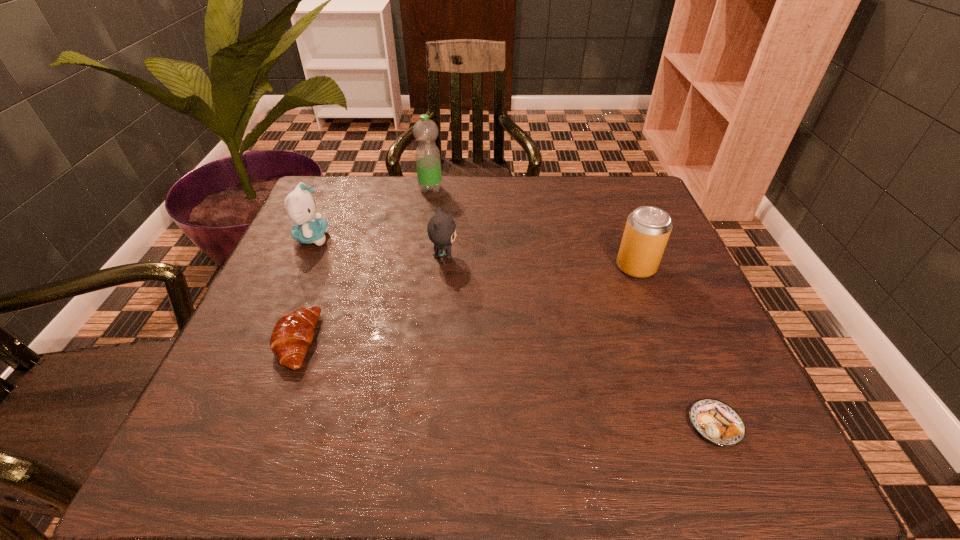
Locate an element on the screen. crescent roll that is at the left edge is located at coordinates (293, 333).

I want to click on pop (soda) that is at the right edge, so click(647, 230).

Identify the location of pastry located at the right edge. (717, 422).

At what (x,y) coordinates should I click in order to perform the action: click on object that is at the far left corner. Please return your answer as a coordinate pair (x, y). The height and width of the screenshot is (540, 960). Looking at the image, I should click on (300, 205).

Locate an element on the screen. This screenshot has width=960, height=540. object located in the near right corner section of the desktop is located at coordinates (717, 422).

Where is `vacant area at the far edge`? The height and width of the screenshot is (540, 960). vacant area at the far edge is located at coordinates (521, 189).

You are a GUI agent. You are given a task and a screenshot of the screen. Output one action in this format:
    pyautogui.click(x=<x>, y=<y>)
    Task: Click on the vacant space at the near edge
    Image resolution: width=960 pixels, height=540 pixels.
    Given the screenshot: What is the action you would take?
    (x=437, y=441)

The image size is (960, 540). In order to click on vacant space at the left edge of the desktop in this screenshot , I will do `click(327, 240)`.

Image resolution: width=960 pixels, height=540 pixels. What are the coordinates of `free space at the right edge of the desktop` in the screenshot? It's located at (676, 418).

What are the coordinates of `vacant space at the far left corner of the desktop` in the screenshot? It's located at pos(350,186).